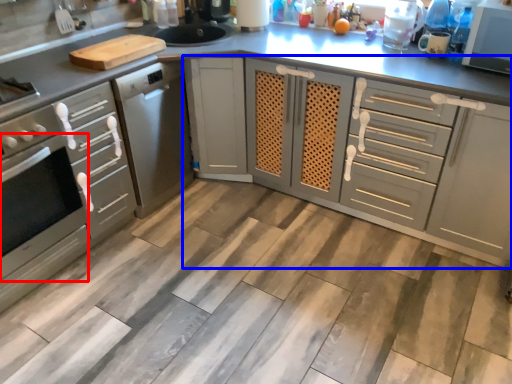
Question: Among these objects, which one is nearest to the camera, oven (highlighted by a red box) or cabinetry (highlighted by a blue box)?

Choices:
 (A) oven
 (B) cabinetry

Answer: (A)